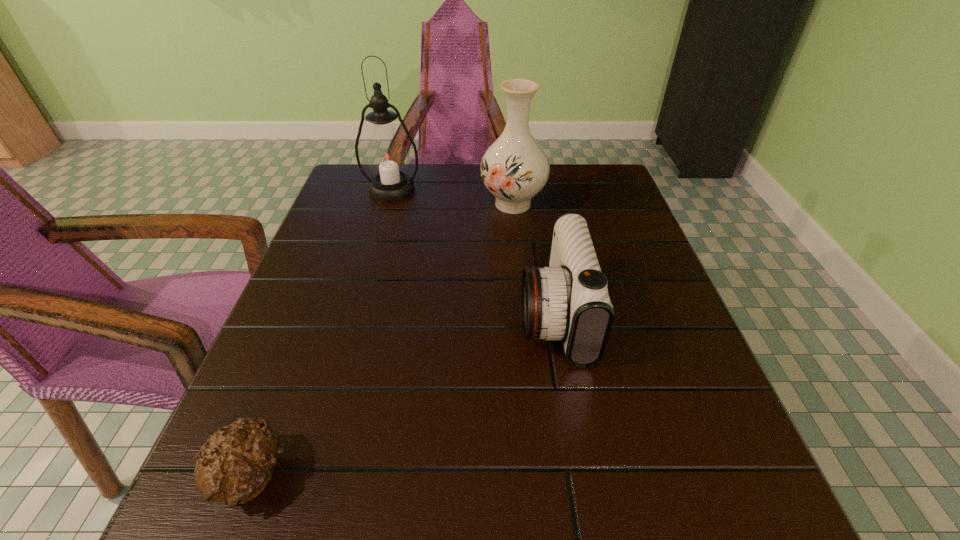
The height and width of the screenshot is (540, 960). Find the location of `vacant point at the near edge`. vacant point at the near edge is located at coordinates (553, 537).

Locate an element on the screen. Image resolution: width=960 pixels, height=540 pixels. vacant space at the left edge of the desktop is located at coordinates click(305, 353).

Image resolution: width=960 pixels, height=540 pixels. In the image, there is a desktop. In order to click on vacant region at the right edge in this screenshot , I will do `click(661, 378)`.

Image resolution: width=960 pixels, height=540 pixels. In order to click on free space at the far right corner of the desktop in this screenshot , I will do `click(601, 202)`.

The width and height of the screenshot is (960, 540). Find the location of `free space at the near right corner`. free space at the near right corner is located at coordinates (695, 486).

You are a GUI agent. You are given a task and a screenshot of the screen. Output one action in this format:
    pyautogui.click(x=<x>, y=<y>)
    Task: Click on the empty space that is in between the oil lamp and the muffin
    Image resolution: width=960 pixels, height=540 pixels.
    Given the screenshot: What is the action you would take?
    pyautogui.click(x=321, y=333)

Where is `unoccupied area between the oil lamp and the muffin`? This screenshot has height=540, width=960. unoccupied area between the oil lamp and the muffin is located at coordinates (321, 333).

The height and width of the screenshot is (540, 960). I want to click on vacant area between the muffin and the vase, so click(381, 340).

The height and width of the screenshot is (540, 960). Find the location of `free spot between the shortest object and the vase`. free spot between the shortest object and the vase is located at coordinates (381, 340).

The image size is (960, 540). In order to click on vacant space that is in between the oil lamp and the nearest object in this screenshot , I will do `click(321, 333)`.